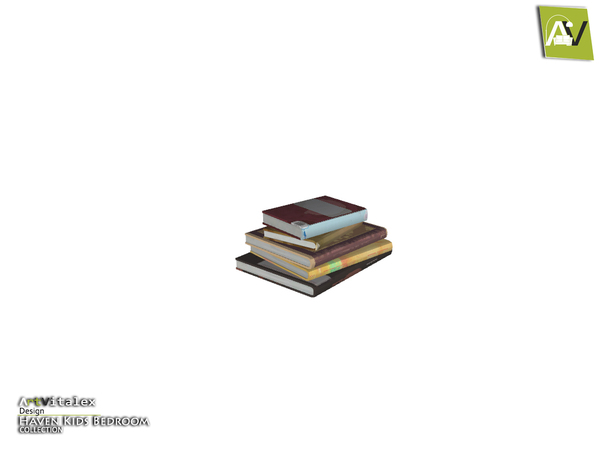
You are a GUI agent. You are given a task and a screenshot of the screen. Output one action in this format:
    pyautogui.click(x=<x>, y=<y>)
    Task: Click on the stack of books
    
    Given the screenshot: What is the action you would take?
    pyautogui.click(x=342, y=260)